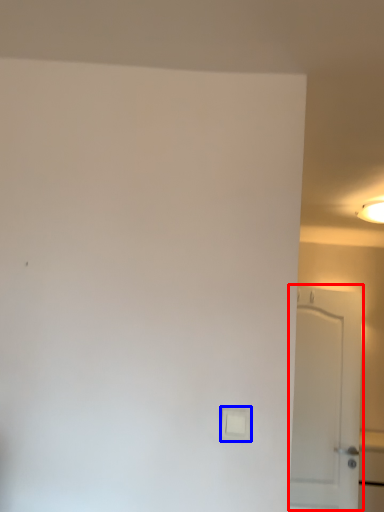
Question: Which point is closer to the camera, door (highlighted by a red box) or light switch (highlighted by a blue box)?

Choices:
 (A) door
 (B) light switch

Answer: (B)